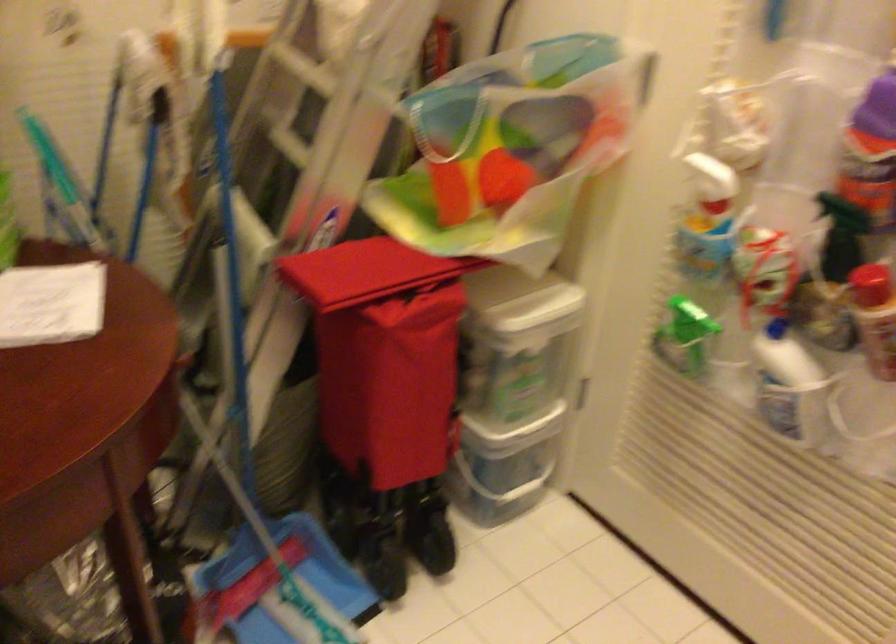
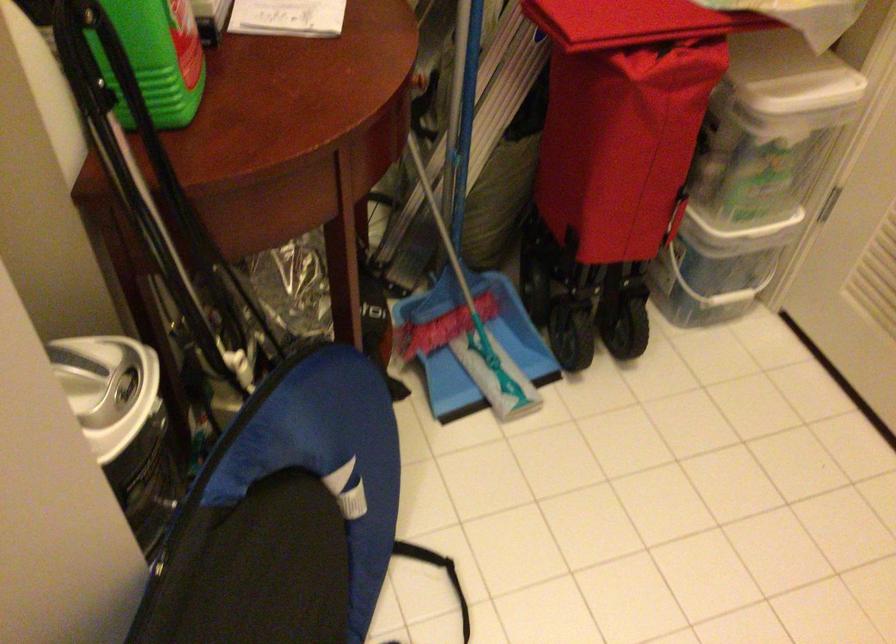
In the second image, find the point that corresponds to point 228,337 in the first image.

(460, 71)